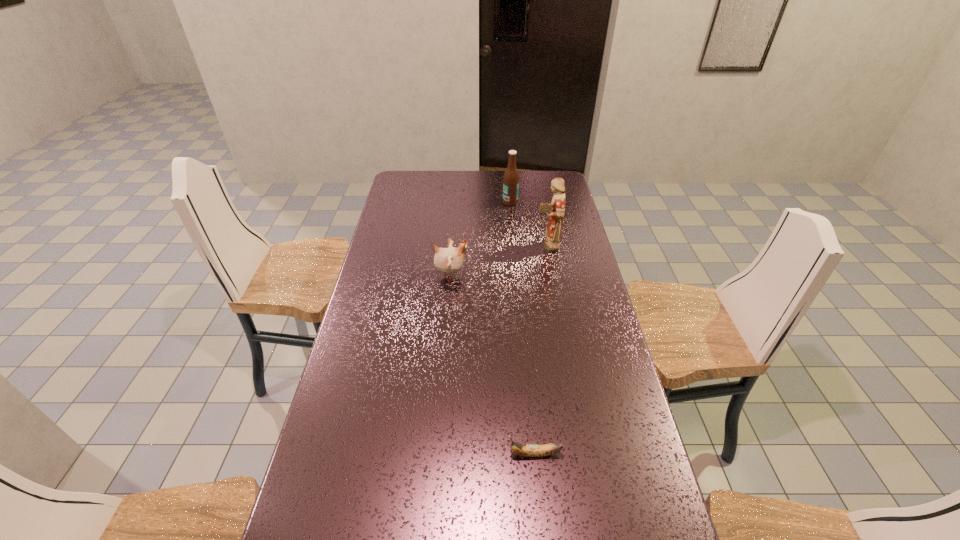
I want to click on vacant point located between the leftmost object and the third shortest object, so click(481, 239).

Select which object is the second closest to the tallest object. Please provide its 2D coordinates. Your answer should be formatted as a tuple, i.e. [(x, y)], where the tuple contains the x and y coordinates of a point satisfying the conditions above.

[(448, 261)]

At what (x,y) coordinates should I click in order to perform the action: click on the third closest object to the nearest object. Please return your answer as a coordinate pair (x, y). The height and width of the screenshot is (540, 960). Looking at the image, I should click on (511, 176).